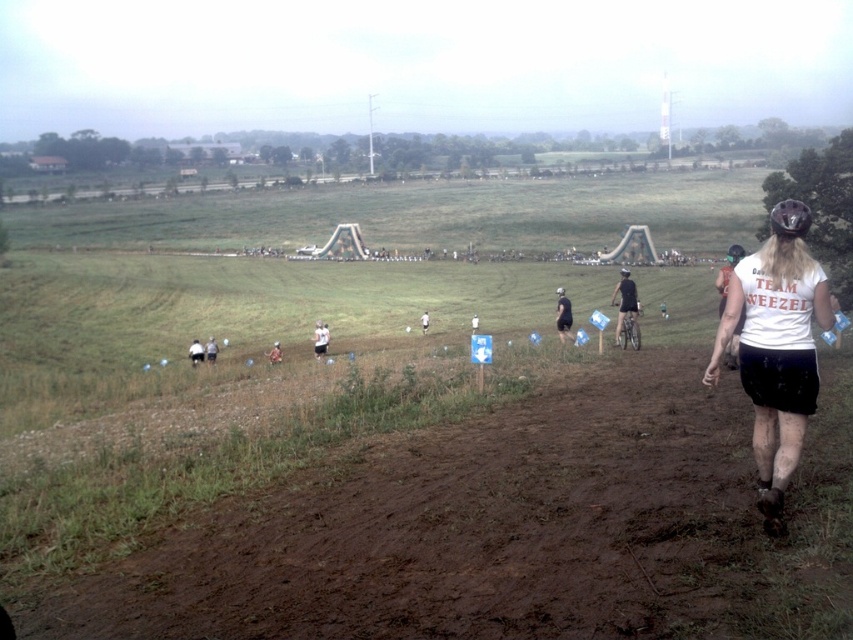
Is dark blue shorts at center to the left of white cotton shirt at center from the viewer's perspective?

Indeed, dark blue shorts at center is positioned on the left side of white cotton shirt at center.

Which is behind, point (206, 355) or point (427, 317)?

The point (427, 317) is behind.

You are a GUI agent. You are given a task and a screenshot of the screen. Output one action in this format:
    pyautogui.click(x=<x>, y=<y>)
    Task: Click on the dark blue shorts at center
    This screenshot has width=853, height=640.
    Given the screenshot: What is the action you would take?
    pyautogui.click(x=212, y=349)

You are a GUI agent. You are given a task and a screenshot of the screen. Output one action in this format:
    pyautogui.click(x=<x>, y=<y>)
    Task: Click on the dark blue shorts at center
    This screenshot has width=853, height=640.
    Given the screenshot: What is the action you would take?
    pyautogui.click(x=212, y=349)

Who is shorter, brown dirt track at lower center or dark blue shorts at center?

With less height is dark blue shorts at center.

Does brown dirt track at lower center have a larger size compared to dark blue shorts at center?

Indeed, brown dirt track at lower center has a larger size compared to dark blue shorts at center.

Is point (22, 598) positioned in front of point (213, 344)?

Yes, it is in front of point (213, 344).

At what (x,y) coordinates should I click in order to perform the action: click on brown dirt track at lower center. Please return your answer as a coordinate pair (x, y). The image size is (853, 640). Looking at the image, I should click on (509, 531).

What do you see at coordinates (775, 356) in the screenshot? I see `white cotton shirt at right` at bounding box center [775, 356].

The image size is (853, 640). What are the coordinates of `white cotton shirt at right` in the screenshot? It's located at (775, 356).

Does point (753, 344) come in front of point (633, 340)?

That is True.

This screenshot has width=853, height=640. Identify the location of white cotton shirt at right. (775, 356).